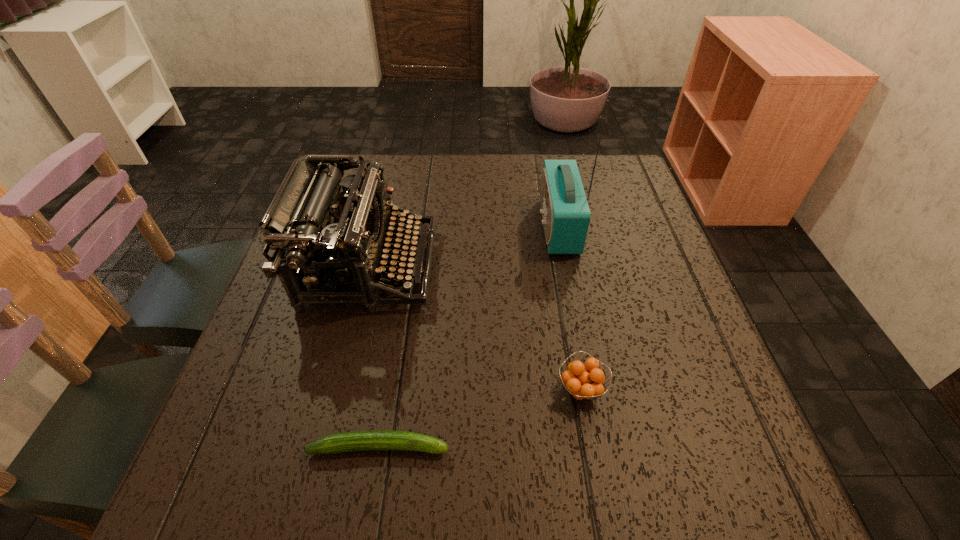
What are the coordinates of `vacant space that's between the typewriter and the tallest object` in the screenshot? It's located at click(464, 246).

Locate an element on the screen. unoccupied position between the third shortest object and the second nearest object is located at coordinates (475, 328).

The width and height of the screenshot is (960, 540). I want to click on free space between the tallest object and the zucchini, so click(469, 336).

Find the location of a particular element. Image resolution: width=960 pixels, height=540 pixels. vacant area that lies between the shortest object and the tallest object is located at coordinates (469, 336).

Find the location of a particular element. This screenshot has width=960, height=540. free space that is in between the orange fruit and the nearest object is located at coordinates (480, 418).

Find the location of a particular element. This screenshot has width=960, height=540. free point between the third farthest object and the nearest object is located at coordinates (480, 418).

At what (x,y) coordinates should I click in order to perform the action: click on free space between the radio receiver and the third farthest object. Please return your answer as a coordinate pair (x, y). This screenshot has width=960, height=540. Looking at the image, I should click on (570, 308).

Identify the location of free space that is in between the orange fruit and the typewriter. The image size is (960, 540). (475, 328).

Identify the location of vacant region between the third tallest object and the nearest object. (480, 418).

Find the location of a particular element. free space between the typewriter and the orange fruit is located at coordinates (475, 328).